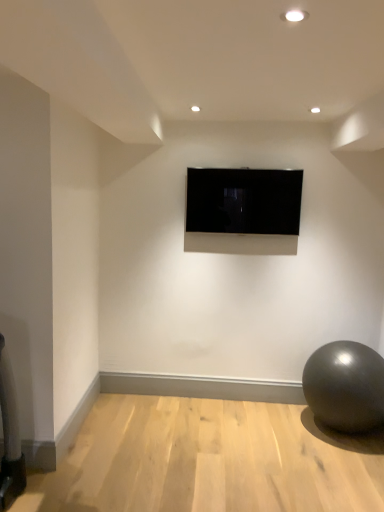
The height and width of the screenshot is (512, 384). Describe the element at coordinates (345, 386) in the screenshot. I see `shiny metallic ball at lower right` at that location.

Measure the distance between point (x=326, y=376) and camera.

Point (x=326, y=376) and camera are 2.99 meters apart from each other.

Find the location of `shiny metallic ball at lower right`. shiny metallic ball at lower right is located at coordinates (345, 386).

At what (x,y) coordinates should I click in order to perform the action: click on black glossy tv at center. Please return your answer as a coordinate pair (x, y). This screenshot has height=512, width=384. Looking at the image, I should click on (243, 201).

This screenshot has height=512, width=384. What do you see at coordinates (243, 201) in the screenshot? I see `black glossy tv at center` at bounding box center [243, 201].

This screenshot has width=384, height=512. In order to click on shiny metallic ball at lower right in this screenshot , I will do `click(345, 386)`.

Which is more to the right, shiny metallic ball at lower right or black glossy tv at center?

shiny metallic ball at lower right.

Relative to black glossy tv at center, is shiny metallic ball at lower right in front or behind?

shiny metallic ball at lower right is in front of black glossy tv at center.

Between point (344, 352) and point (282, 227), which one is positioned in front?

Point (344, 352)

From the image's perspective, is shiny metallic ball at lower right on black glossy tv at center?

Incorrect, from the image's perspective, shiny metallic ball at lower right is lower than black glossy tv at center.

From a real-world perspective, between shiny metallic ball at lower right and black glossy tv at center, who is vertically higher?

black glossy tv at center is physically above.

Considering the relative sizes of shiny metallic ball at lower right and black glossy tv at center in the image provided, is shiny metallic ball at lower right thinner than black glossy tv at center?

No.

From their relative heights in the image, would you say shiny metallic ball at lower right is taller or shorter than black glossy tv at center?

Clearly, shiny metallic ball at lower right is taller compared to black glossy tv at center.

Can you confirm if shiny metallic ball at lower right is smaller than black glossy tv at center?

Answer: Actually, shiny metallic ball at lower right might be larger than black glossy tv at center.

Is shiny metallic ball at lower right inside the boundaries of black glossy tv at center, or outside?

shiny metallic ball at lower right cannot be found inside black glossy tv at center.

Is shiny metallic ball at lower right not close to black glossy tv at center?

Indeed, shiny metallic ball at lower right is not near black glossy tv at center.

Does shiny metallic ball at lower right turn towards black glossy tv at center?

No, shiny metallic ball at lower right is not facing towards black glossy tv at center.

Identify the location of television above the shiny metallic ball at lower right (from the image's perspective). (243, 201).

Based on their positions, is black glossy tv at center located to the left or right of shiny metallic ball at lower right?

Clearly, black glossy tv at center is on the left of shiny metallic ball at lower right in the image.

Is black glossy tv at center closer to camera compared to shiny metallic ball at lower right?

No, black glossy tv at center is behind shiny metallic ball at lower right.

Which is in front, point (266, 214) or point (323, 416)?

Point (323, 416)

Consider the image. From the image's perspective, which one is positioned higher, black glossy tv at center or shiny metallic ball at lower right?

black glossy tv at center.

From a real-world perspective, between black glossy tv at center and shiny metallic ball at lower right, who is vertically higher?

black glossy tv at center.

In terms of width, does black glossy tv at center look wider or thinner when compared to shiny metallic ball at lower right?

In the image, black glossy tv at center appears to be more narrow than shiny metallic ball at lower right.

Considering the sizes of black glossy tv at center and shiny metallic ball at lower right in the image, is black glossy tv at center taller or shorter than shiny metallic ball at lower right?

In the image, black glossy tv at center appears to be shorter than shiny metallic ball at lower right.

Looking at the image, does black glossy tv at center seem bigger or smaller compared to shiny metallic ball at lower right?

Clearly, black glossy tv at center is smaller in size than shiny metallic ball at lower right.

Is black glossy tv at center positioned beyond the bounds of shiny metallic ball at lower right?

That's correct, black glossy tv at center is outside of shiny metallic ball at lower right.

Is black glossy tv at center in contact with shiny metallic ball at lower right?

black glossy tv at center and shiny metallic ball at lower right are clearly separated.

Is black glossy tv at center oriented away from shiny metallic ball at lower right?

That's not correct — black glossy tv at center is not looking away from shiny metallic ball at lower right.

How far apart are black glossy tv at center and shiny metallic ball at lower right?

black glossy tv at center is 4.09 feet from shiny metallic ball at lower right.

Where is `television on the left side of shiny metallic ball at lower right`? This screenshot has width=384, height=512. television on the left side of shiny metallic ball at lower right is located at coordinates (243, 201).

Image resolution: width=384 pixels, height=512 pixels. I want to click on ball in front of the black glossy tv at center, so pyautogui.click(x=345, y=386).

You are a GUI agent. You are given a task and a screenshot of the screen. Output one action in this format:
    pyautogui.click(x=<x>, y=<y>)
    Task: Click on the television above the shiny metallic ball at lower right (from the image's perspective)
    This screenshot has height=512, width=384.
    Given the screenshot: What is the action you would take?
    pyautogui.click(x=243, y=201)